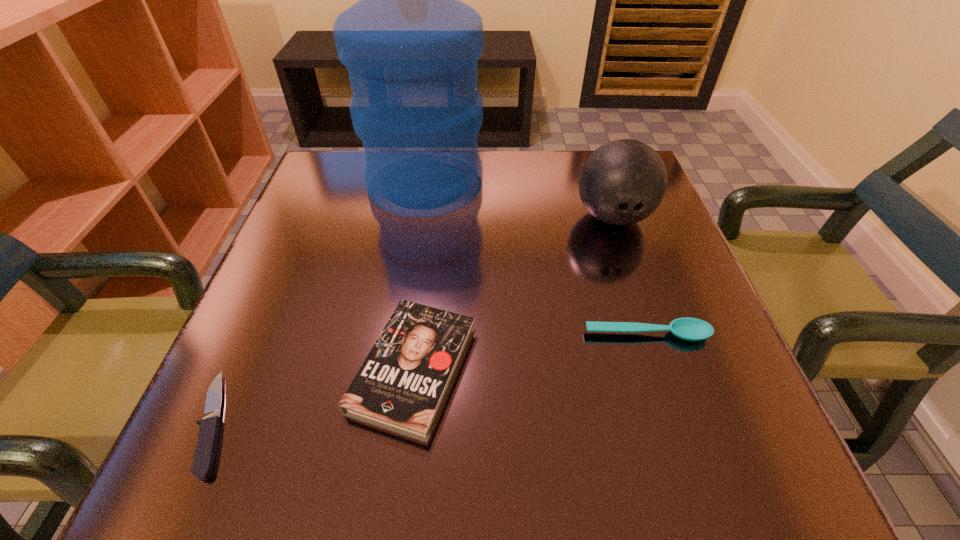
At what (x,y) coordinates should I click in order to perform the action: click on object that is at the near left corner. Please return your answer as a coordinate pair (x, y). This screenshot has height=540, width=960. Looking at the image, I should click on (207, 443).

Locate an element on the screen. The image size is (960, 540). object at the far right corner is located at coordinates (622, 182).

I want to click on vacant space at the far edge, so click(564, 194).

Locate an element on the screen. The height and width of the screenshot is (540, 960). vacant space at the left edge of the desktop is located at coordinates (341, 271).

In the image, there is a desktop. Where is `free region at the right edge`? free region at the right edge is located at coordinates [x=726, y=374].

Locate an element on the screen. Image resolution: width=960 pixels, height=540 pixels. vacant region at the far left corner of the desktop is located at coordinates (325, 184).

In the image, there is a desktop. At what (x,y) coordinates should I click in order to perform the action: click on vacant space at the near left corner. Please return your answer as a coordinate pair (x, y). Looking at the image, I should click on (177, 481).

Locate an element on the screen. The height and width of the screenshot is (540, 960). vacant region between the bowling ball and the water jug is located at coordinates (519, 200).

This screenshot has width=960, height=540. What are the coordinates of `free space between the book and the shortest object` in the screenshot? It's located at (314, 396).

At what (x,y) coordinates should I click in order to perform the action: click on free spot between the shortest object and the tallest object. Please return your answer as a coordinate pair (x, y). The height and width of the screenshot is (540, 960). Looking at the image, I should click on (320, 303).